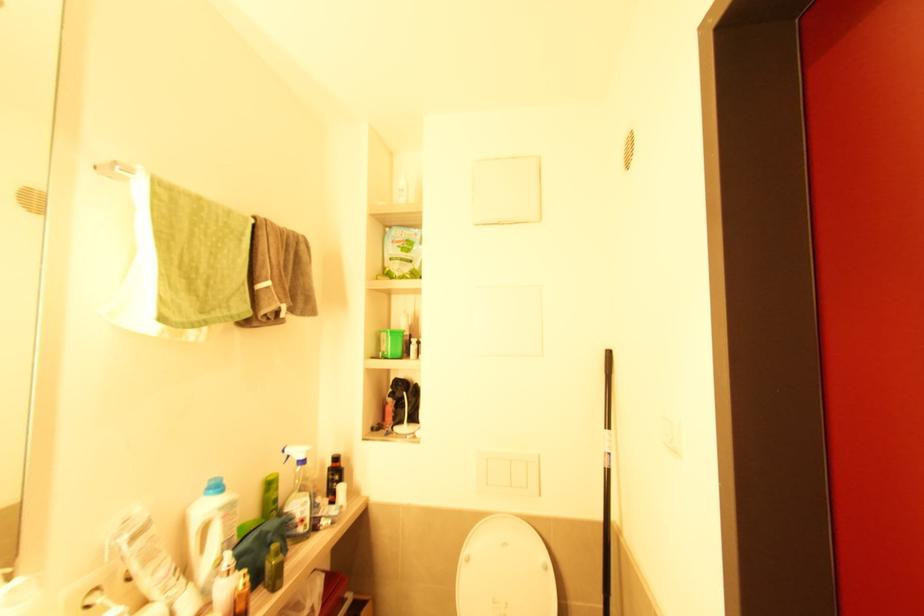
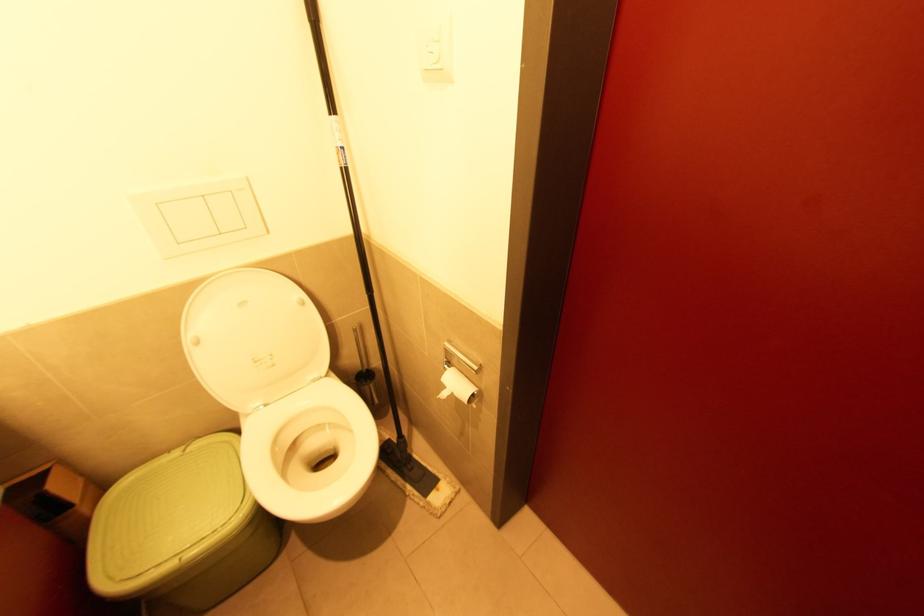
The first image is from the beginning of the video and the second image is from the end. How did the camera likely rotate when shooting the video?

The rotation direction of the camera is right-down.